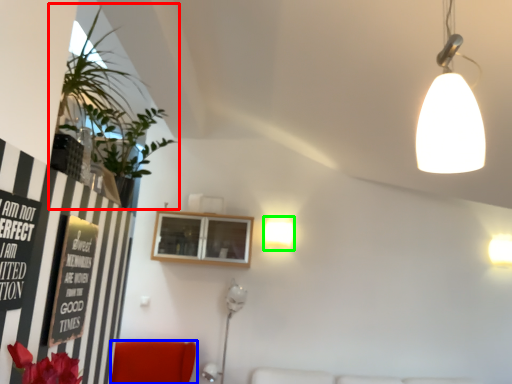
Question: Estimate the real-world distances between objects in this image. Which object is closer to houseplant (highlighted by a red box), furniture (highlighted by a blue box) or lamp (highlighted by a green box)?

Choices:
 (A) furniture
 (B) lamp

Answer: (A)